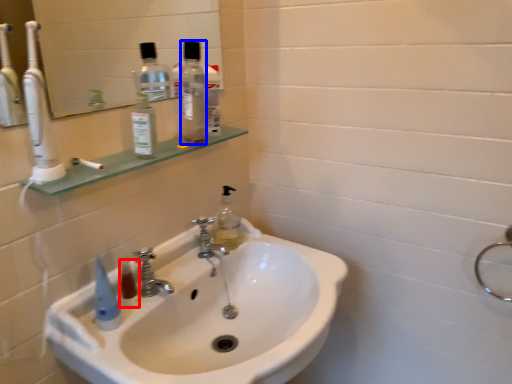
Question: Which object is closer to the camera taking this photo, mouthwash (highlighted by a red box) or bottle (highlighted by a blue box)?

Choices:
 (A) mouthwash
 (B) bottle

Answer: (A)